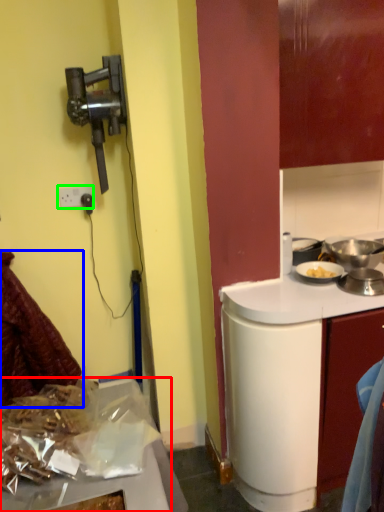
Question: Based on their relative distances, which object is nearer to kitchen appliance (highlighted by a red box)? Choose from laundry (highlighted by a blue box) and power outlet (highlighted by a green box).

Choices:
 (A) laundry
 (B) power outlet

Answer: (A)